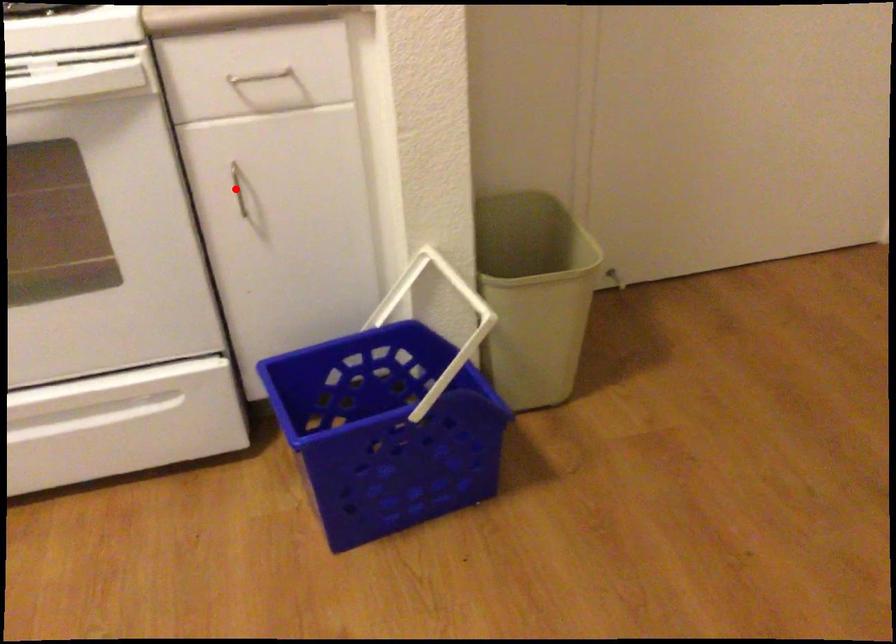
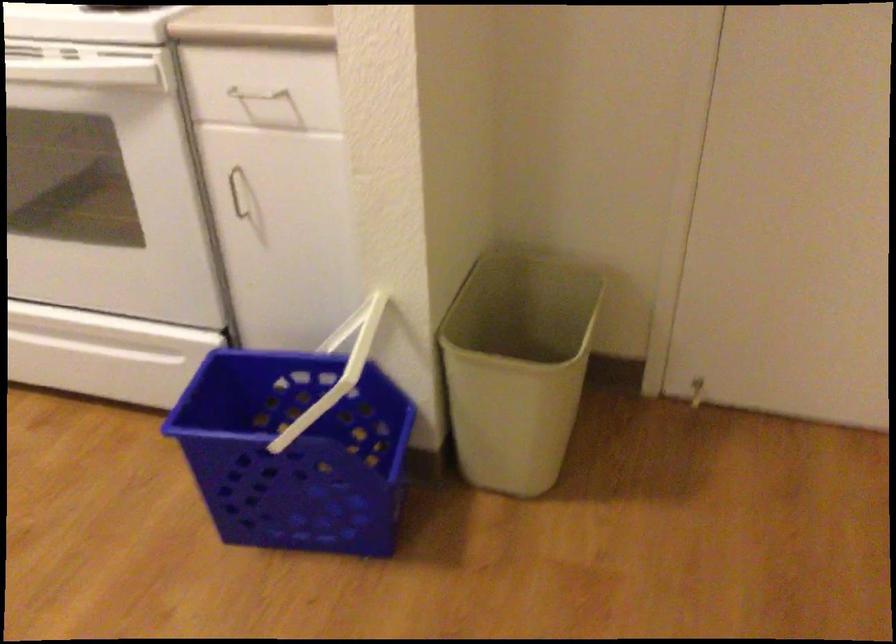
In the second image, find the point that corresponds to the highlighted location in the first image.

(237, 192)